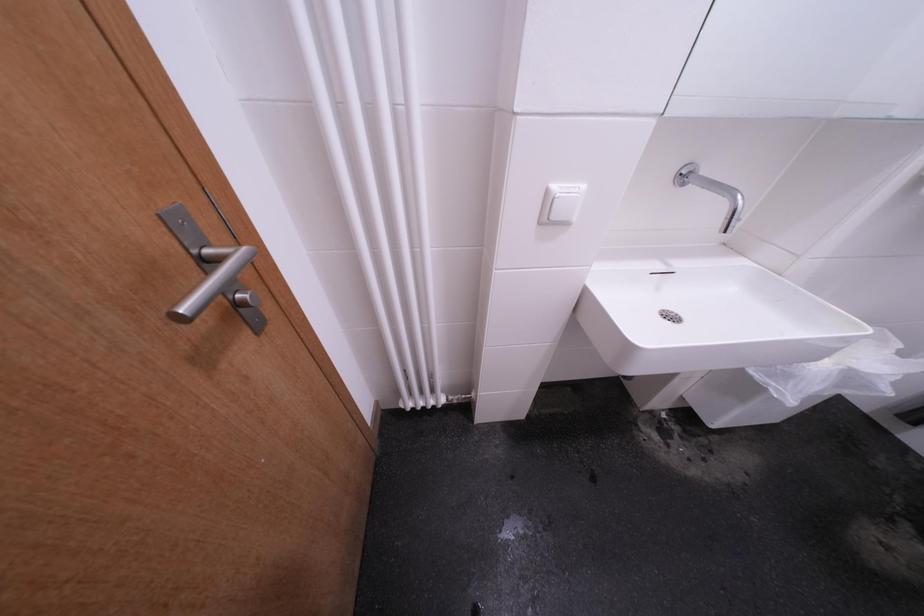
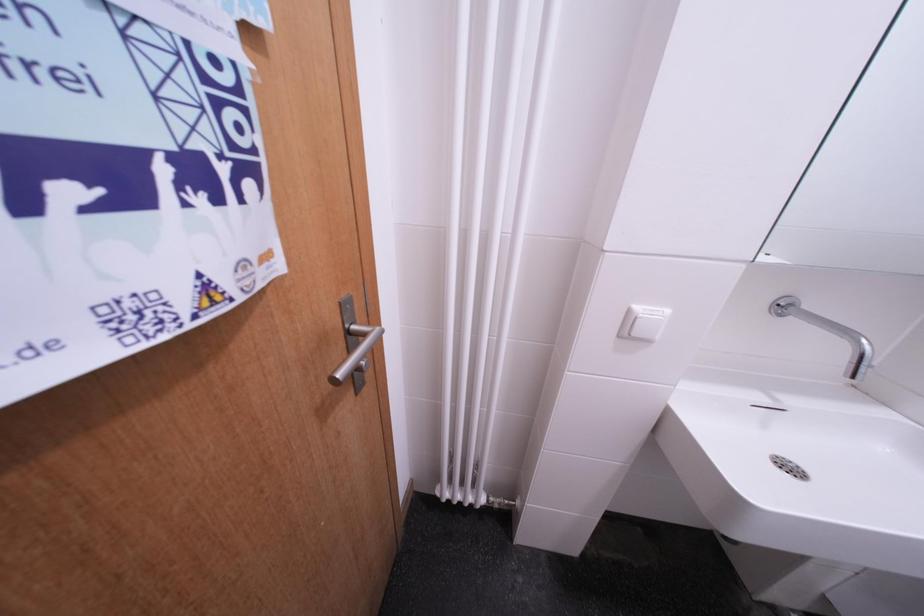
In a continuous first-person perspective shot, in which direction is the camera moving?

The cameraman moved toward left, backward.